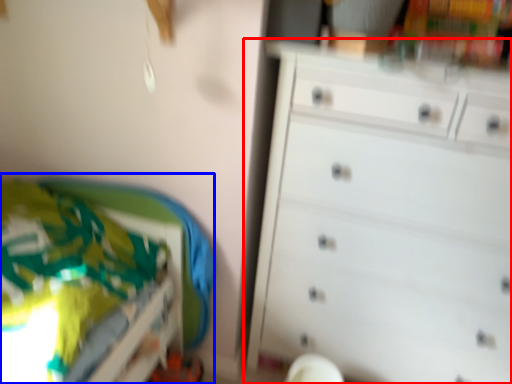
Question: Which of the following is the closest to the observer, chest of drawers (highlighted by a red box) or bed (highlighted by a blue box)?

Choices:
 (A) chest of drawers
 (B) bed

Answer: (B)